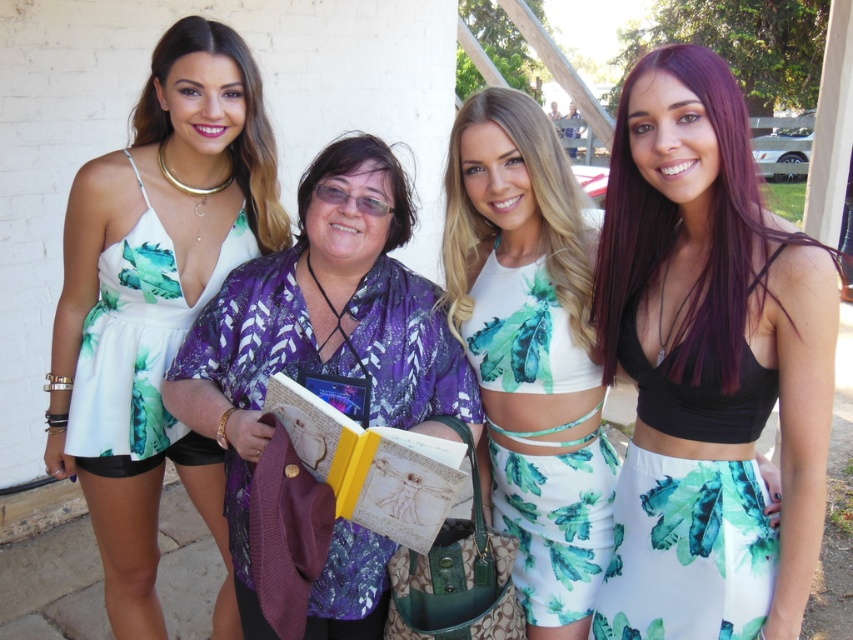
Question: Is purple floral kimono at center behind matte gold necklace at upper left?

Choices:
 (A) yes
 (B) no

Answer: (B)

Question: Is white fabric romper at left above matte gold necklace at upper left?

Choices:
 (A) yes
 (B) no

Answer: (B)

Question: Which object is farther from the camera taking this photo?

Choices:
 (A) black matte crop top at right
 (B) white printed fabric top at center
 (C) matte gold necklace at upper left
 (D) white floral fabric dress at left

Answer: (D)

Question: Is white fabric romper at left above black matte bikini top at right?

Choices:
 (A) no
 (B) yes

Answer: (A)

Question: Among these points, which one is farthest from the camera?

Choices:
 (A) (714, 237)
 (B) (231, 467)

Answer: (B)

Question: Based on their relative distances, which object is farther from the black matte bikini top at right?

Choices:
 (A) white fabric romper at left
 (B) white floral fabric dress at left

Answer: (B)